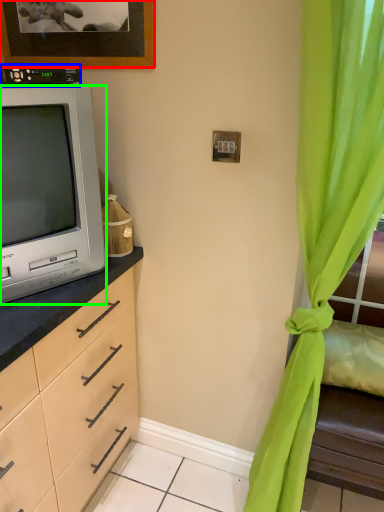
Question: Considering the real-world distances, which object is farthest from picture frame (highlighted by a red box)? appliance (highlighted by a blue box) or television (highlighted by a green box)?

Choices:
 (A) appliance
 (B) television

Answer: (B)